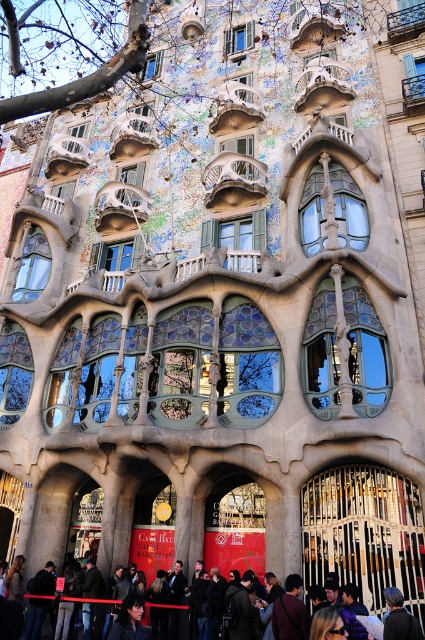
Question: Does brown textured tree at upper left lie behind dark brown leather jacket at lower center?

Choices:
 (A) no
 (B) yes

Answer: (B)

Question: Which object is farther from the camera taking this photo?

Choices:
 (A) dark brown leather jacket at lower center
 (B) brown textured tree at upper left

Answer: (B)

Question: Which object appears closest to the camera in this image?

Choices:
 (A) dark brown leather jacket at lower center
 (B) brown textured tree at upper left

Answer: (A)

Question: Considering the relative positions of brown textured tree at upper left and dark brown leather jacket at lower center in the image provided, where is brown textured tree at upper left located with respect to dark brown leather jacket at lower center?

Choices:
 (A) above
 (B) below

Answer: (A)

Question: Considering the relative positions of brown textured tree at upper left and dark brown leather jacket at lower center in the image provided, where is brown textured tree at upper left located with respect to dark brown leather jacket at lower center?

Choices:
 (A) right
 (B) left

Answer: (B)